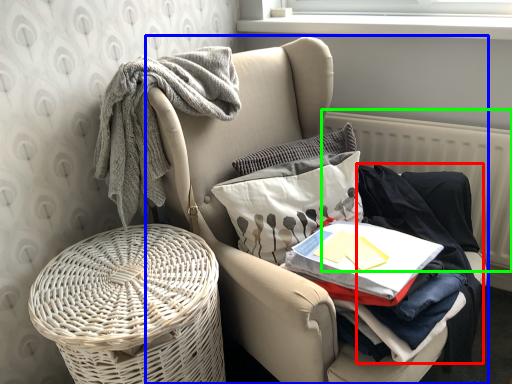
Question: Estimate the real-world distances between objects in this image. Which object is farther from clothing (highlighted by a red box), chair (highlighted by a blue box) or radiator (highlighted by a green box)?

Choices:
 (A) chair
 (B) radiator

Answer: (A)